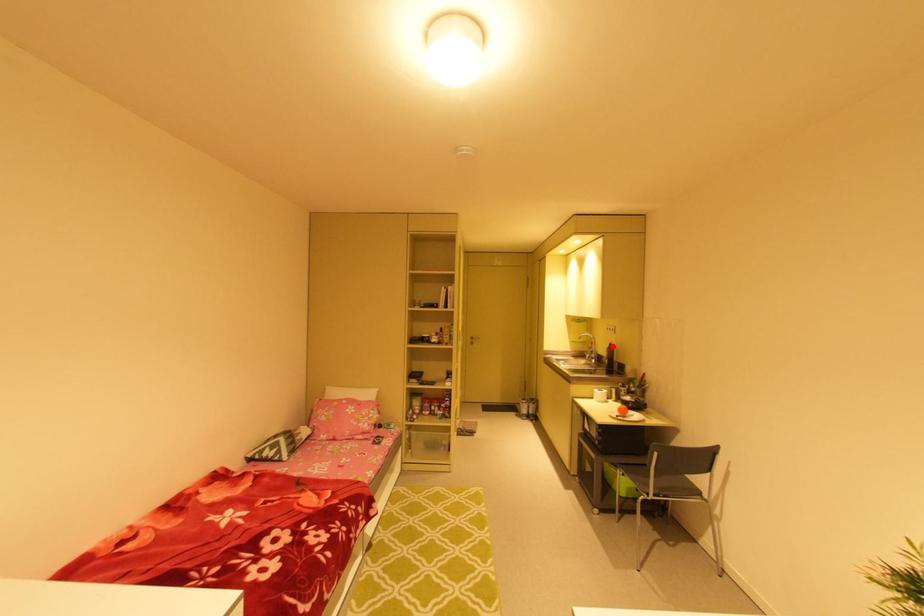
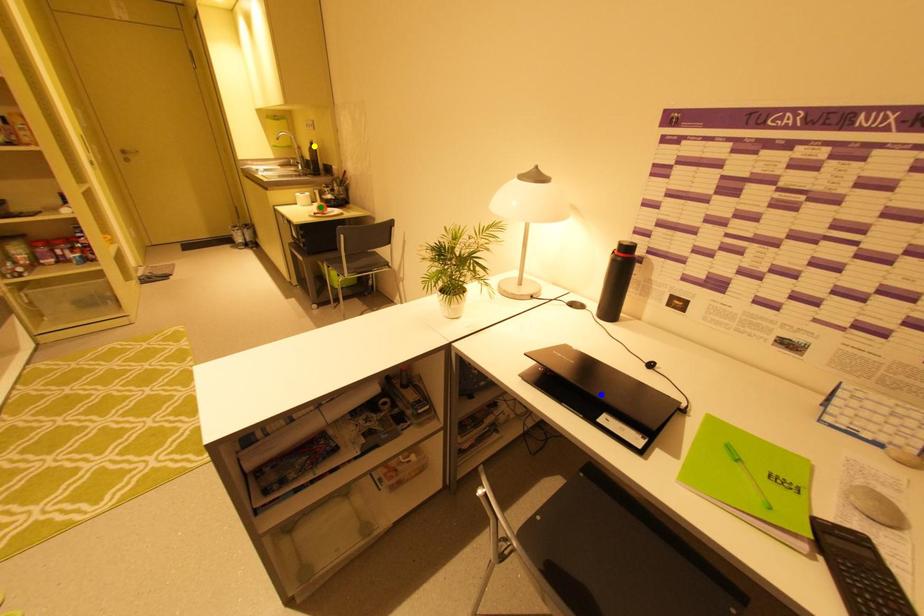
Question: I am providing you with two images of the same scene from different viewpoints. A red point is marked on the first image. You are given multiple points on the second image. In image 2, which mark is for the same physical point as the one in image 1?

Choices:
 (A) green point
 (B) yellow point
 (C) blue point

Answer: (B)